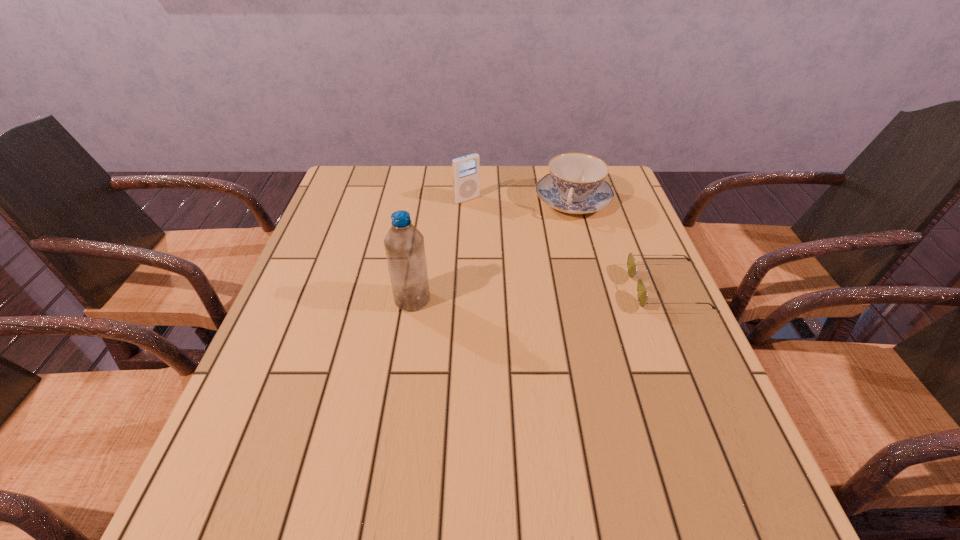
Find the location of a particular element. The image size is (960, 540). vacant point located between the water bottle and the sunglasses is located at coordinates (540, 294).

The height and width of the screenshot is (540, 960). What are the coordinates of `vacant area that lies between the shortest object and the tallest object` in the screenshot? It's located at (540, 294).

Find the location of a particular element. vacant region between the shortest object and the water bottle is located at coordinates (540, 294).

Where is `vacant space that is in between the second shortest object and the shortest object`? vacant space that is in between the second shortest object and the shortest object is located at coordinates (620, 245).

What are the coordinates of `free area in between the second shortest object and the tallest object` in the screenshot? It's located at (492, 250).

Identify the location of empty space between the water bottle and the third object from right to left. The height and width of the screenshot is (540, 960). (440, 249).

Where is `vacant space that is in between the sunglasses and the chinaware`? The width and height of the screenshot is (960, 540). vacant space that is in between the sunglasses and the chinaware is located at coordinates (620, 245).

Find the location of a particular element. The image size is (960, 540). object that is the closest one to the leftmost object is located at coordinates (466, 170).

Identify the location of object that is the second closest to the chinaware. The height and width of the screenshot is (540, 960). (642, 295).

I want to click on vacant space that satisfies the following two spatial constraints: 1. on the back side of the shortest object; 2. on the front-facing side of the tallest object, so click(414, 288).